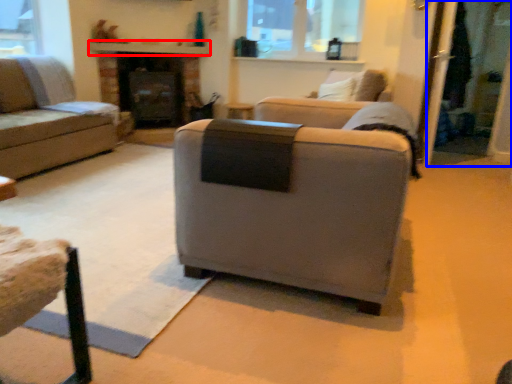
Question: Which object is closer to the camera taking this photo, mantle (highlighted by a red box) or screen door (highlighted by a blue box)?

Choices:
 (A) mantle
 (B) screen door

Answer: (B)